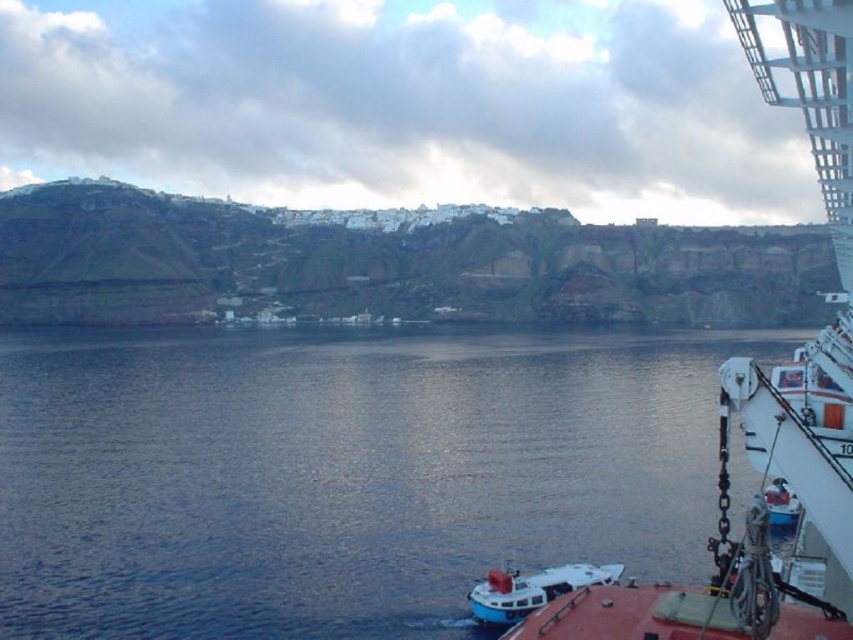
You are standing on the deck of the ship and see the green grassy hillside at upper left and the white matte boat at lower center. Which object is closer to you?

The white matte boat at lower center is behind the green grassy hillside at upper left, so the green grassy hillside at upper left is closer to you.

You are standing on the ship deck and want to take a photo of the dark blue water at lower left. Where should you point your camera to capture it?

You should point your camera towards the lower left area at coordinates approximately 0.739 on the x axis and 0.401 on the y axis to capture the dark blue water at lower left.